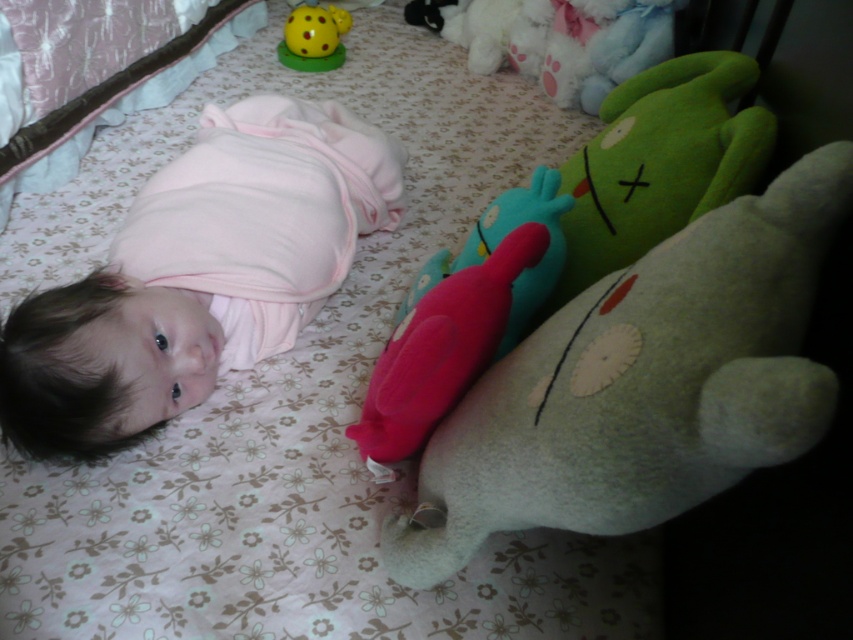
Does pink soft fabric baby at upper left have a greater height compared to rubber duck at center?

Indeed, pink soft fabric baby at upper left has a greater height compared to rubber duck at center.

Between point (200, 234) and point (512, 195), which one is positioned in front?

Positioned in front is point (512, 195).

The height and width of the screenshot is (640, 853). Identify the location of pink soft fabric baby at upper left. (198, 275).

Which is more to the right, rubber duck at center or yellow rubber ball at upper center?

rubber duck at center

What do you see at coordinates (461, 320) in the screenshot?
I see `rubber duck at center` at bounding box center [461, 320].

The height and width of the screenshot is (640, 853). I want to click on rubber duck at center, so click(461, 320).

Where is `rubber duck at center`? rubber duck at center is located at coordinates (461, 320).

Is fluffy green bear at center below pink soft fabric baby at upper left?

Indeed, fluffy green bear at center is positioned under pink soft fabric baby at upper left.

The height and width of the screenshot is (640, 853). Describe the element at coordinates (642, 385) in the screenshot. I see `fluffy green bear at center` at that location.

The image size is (853, 640). I want to click on fluffy green bear at center, so click(x=642, y=385).